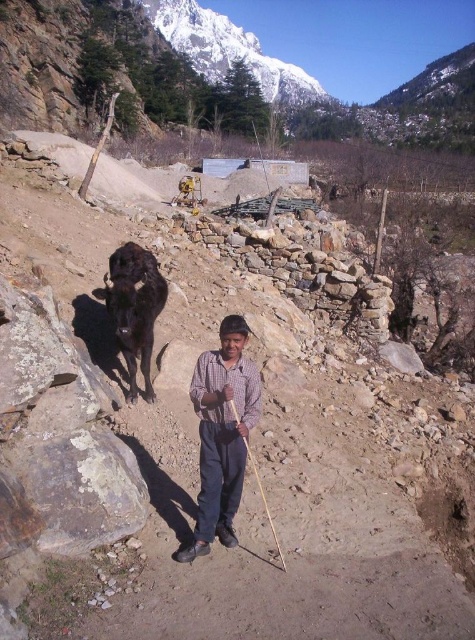
Question: Does checkered fabric shirt at center have a lesser width compared to black glossy yak at center?

Choices:
 (A) no
 (B) yes

Answer: (A)

Question: Which object is farther from the camera taking this photo?

Choices:
 (A) checkered fabric shirt at center
 (B) black glossy yak at center

Answer: (B)

Question: Is checkered fabric shirt at center to the right of black glossy yak at center from the viewer's perspective?

Choices:
 (A) no
 (B) yes

Answer: (B)

Question: Which point is closer to the camera?

Choices:
 (A) (139, 348)
 (B) (228, 486)

Answer: (B)

Question: Can you confirm if checkered fabric shirt at center is bigger than black glossy yak at center?

Choices:
 (A) yes
 (B) no

Answer: (B)